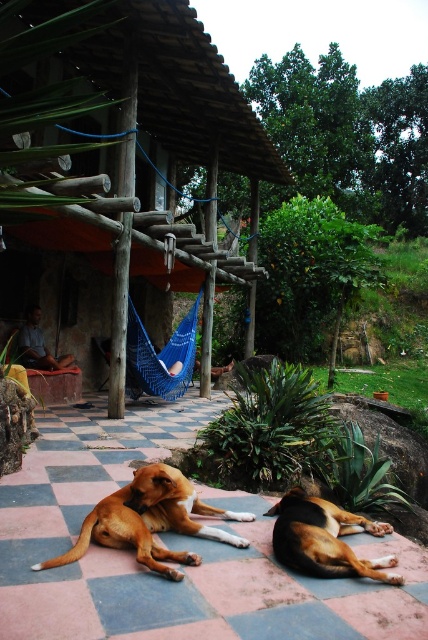
You are a photographer trying to capture both the brown fur dog at lower left and the brown furry dog at lower center in a single shot. Which dog should you position closer to the camera to ensure both are fully visible in the frame?

You should position the brown fur dog at lower left closer to the camera because it might be wider than the brown furry dog at lower center, ensuring both fit within the frame.

You are standing at the entrance of the wooden hut at center. If you walk straight ahead, will you immediately step onto the checkered pink and gray tiled patio where the dogs are lying?

The wooden hut at center is located at point (168, 163), so walking straight ahead from its entrance would lead you directly to the checkered pink and gray tiled patio where the dogs are lying.